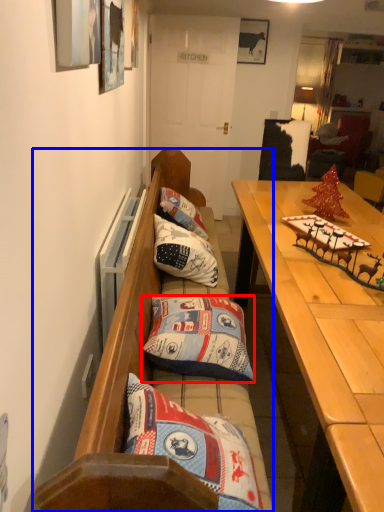
Question: Which object is further to the camera taking this photo, pillow (highlighted by a red box) or studio couch (highlighted by a blue box)?

Choices:
 (A) pillow
 (B) studio couch

Answer: (A)